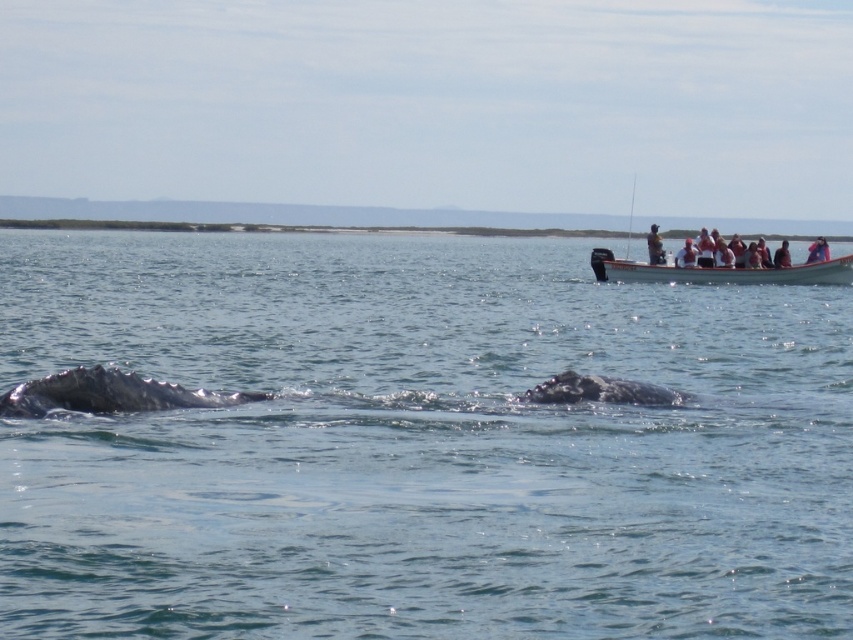
You are a marine biologist observing two boats in a coastal scene. You have a drone that can fly 2 meters. Can your drone reach the white wooden boat at upper right from the light brown wooden boat at upper right without needing to go beyond its range?

The distance between the white wooden boat at upper right and the light brown wooden boat at upper right is 2.61 meters. Since the drone can fly 2 meters, it cannot reach the white wooden boat at upper right from the light brown wooden boat at upper right as the distance exceeds the drone range.

You are a photographer on a boat trying to capture a wide shot of the whales in the clear blue water at center. However, there is a light brown wooden paddle at upper right in your viewfinder. Since you want to focus on the whales, will the paddle block the entire water area? Explain using their sizes.

The clear blue water at center is larger than the light brown wooden paddle at upper right. Since the water area is bigger, the paddle won not block the entire water area, allowing you to capture the whales without full obstruction.